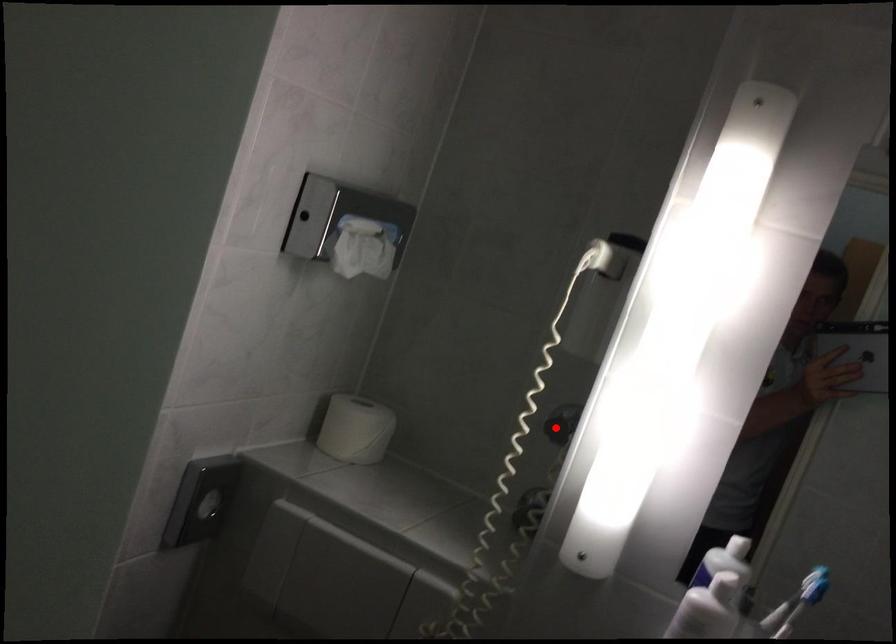
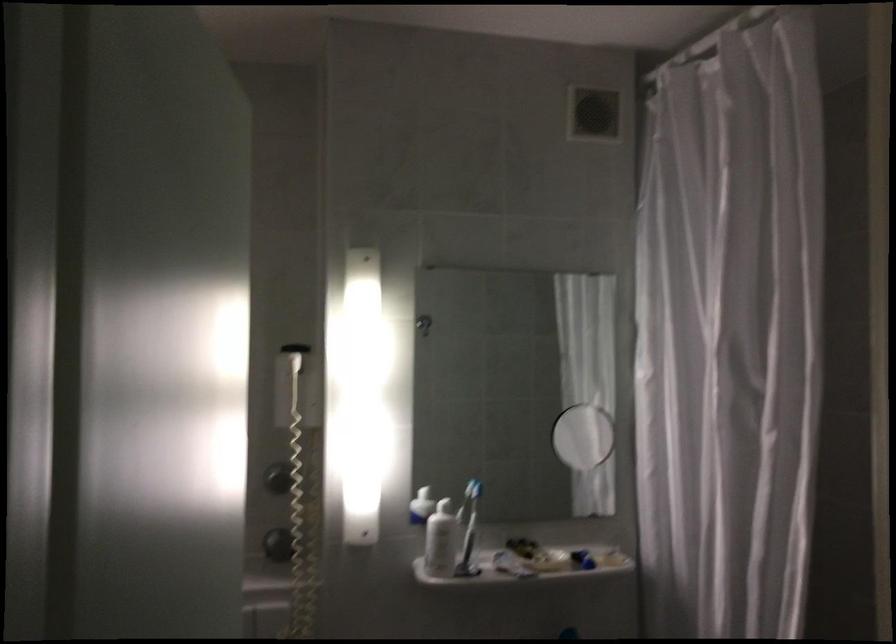
Question: I am providing you with two images of the same scene from different viewpoints. A red point is marked on the first image. Can you still see the location of the red point in image 2?

Choices:
 (A) Yes
 (B) No

Answer: (A)